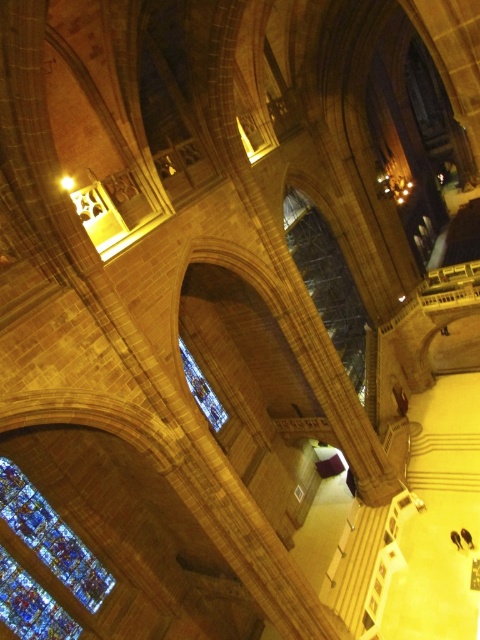
Question: Can you confirm if stained glass window at lower left is bigger than stained glass window at center?

Choices:
 (A) no
 (B) yes

Answer: (B)

Question: Which point appears closest to the camera in this image?

Choices:
 (A) (301, 241)
 (B) (12, 529)

Answer: (B)

Question: Does stained glass window at lower left have a larger size compared to stained glass window at center?

Choices:
 (A) yes
 (B) no

Answer: (A)

Question: Can you confirm if clear glass window at center is wider than stained glass window at center?

Choices:
 (A) yes
 (B) no

Answer: (A)

Question: Considering the real-world distances, which object is closest to the clear glass window at center?

Choices:
 (A) stained glass window at center
 (B) stained glass window at lower left

Answer: (A)

Question: Which of the following is the closest to the observer?

Choices:
 (A) (214, 426)
 (B) (11, 512)

Answer: (B)